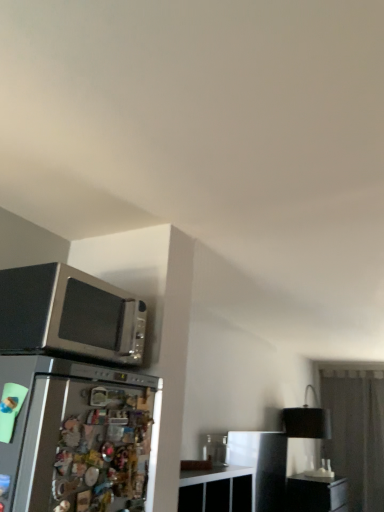
Question: Considering the relative sizes of transparent glass door at right and satin black microwave at upper left in the image provided, is transparent glass door at right thinner than satin black microwave at upper left?

Choices:
 (A) yes
 (B) no

Answer: (A)

Question: From the image's perspective, does transparent glass door at right appear higher than satin black microwave at upper left?

Choices:
 (A) no
 (B) yes

Answer: (A)

Question: Is transparent glass door at right shorter than satin black microwave at upper left?

Choices:
 (A) no
 (B) yes

Answer: (A)

Question: Considering the relative positions of transparent glass door at right and satin black microwave at upper left in the image provided, is transparent glass door at right to the right of satin black microwave at upper left from the viewer's perspective?

Choices:
 (A) no
 (B) yes

Answer: (B)

Question: Is transparent glass door at right oriented away from satin black microwave at upper left?

Choices:
 (A) yes
 (B) no

Answer: (B)

Question: Looking at their shapes, would you say black matte file cabinet at lower right is wider or thinner than satin black microwave at upper left?

Choices:
 (A) thin
 (B) wide

Answer: (B)

Question: In terms of height, does black matte file cabinet at lower right look taller or shorter compared to satin black microwave at upper left?

Choices:
 (A) tall
 (B) short

Answer: (A)

Question: Considering their positions, is black matte file cabinet at lower right located in front of or behind satin black microwave at upper left?

Choices:
 (A) front
 (B) behind

Answer: (B)

Question: Considering the positions of point (332, 499) and point (62, 273), is point (332, 499) closer or farther from the camera than point (62, 273)?

Choices:
 (A) closer
 (B) farther

Answer: (B)

Question: In terms of width, does black matte file cabinet at lower right look wider or thinner when compared to transparent glass door at right?

Choices:
 (A) wide
 (B) thin

Answer: (A)

Question: From the image's perspective, relative to transparent glass door at right, is black matte file cabinet at lower right above or below?

Choices:
 (A) below
 (B) above

Answer: (A)

Question: Considering the positions of black matte file cabinet at lower right and transparent glass door at right in the image, is black matte file cabinet at lower right bigger or smaller than transparent glass door at right?

Choices:
 (A) big
 (B) small

Answer: (B)

Question: Does point (339, 494) appear closer or farther from the camera than point (357, 374)?

Choices:
 (A) farther
 (B) closer

Answer: (B)

Question: From a real-world perspective, is black matte lampshade at right above or below satin black microwave at upper left?

Choices:
 (A) above
 (B) below

Answer: (B)

Question: From the image's perspective, is black matte lampshade at right located above or below satin black microwave at upper left?

Choices:
 (A) below
 (B) above

Answer: (A)